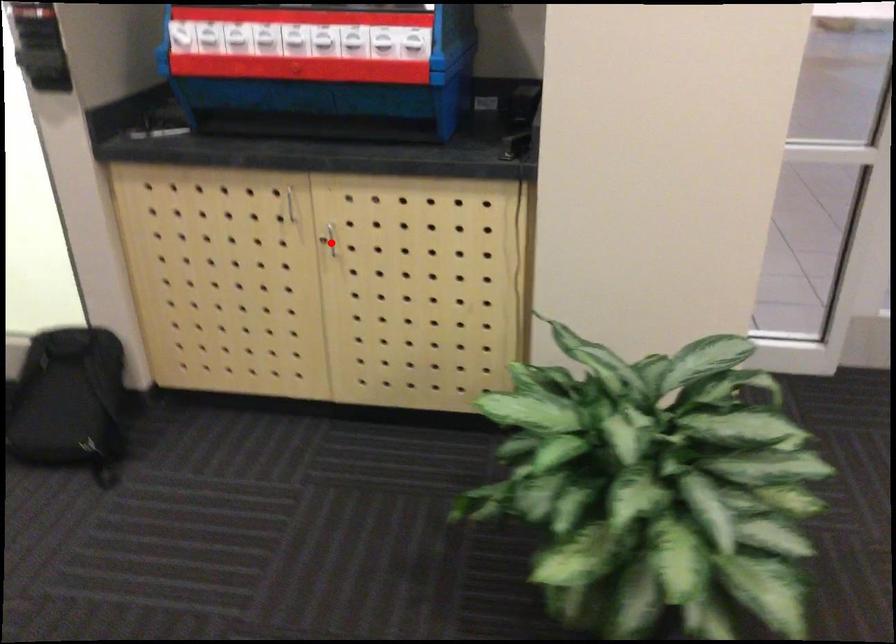
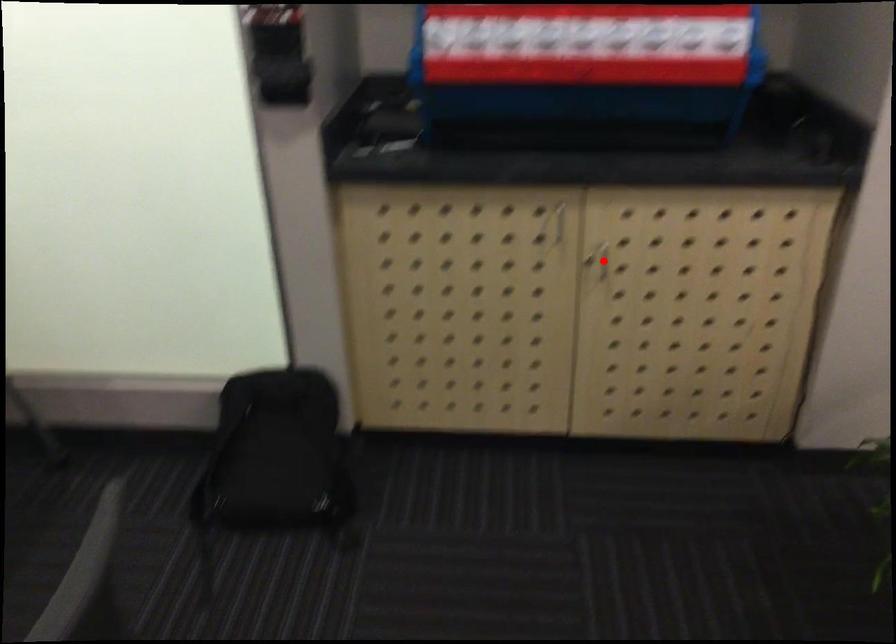
I am providing you with two images of the same scene from different viewpoints. A red point is marked on the first image and another point is marked on the second image. Are the points marked in image1 and image2 representing the same 3D position?

Yes